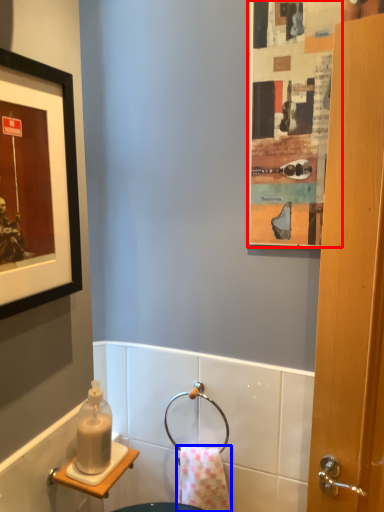
Question: Which point is closer to the camera, poster (highlighted by a red box) or towel/napkin (highlighted by a blue box)?

Choices:
 (A) poster
 (B) towel/napkin

Answer: (A)